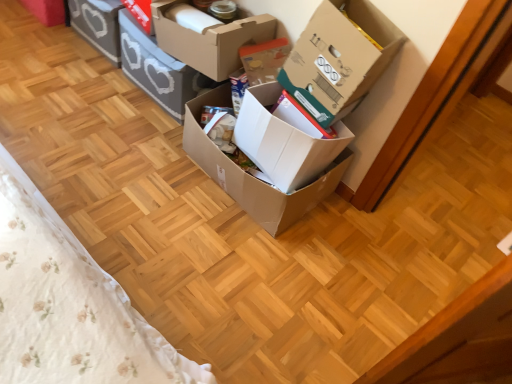
Question: Is cardboard box at center, arranged as the 5th box when viewed from the left, located outside matte gray storage box at upper left, the first box positioned from the left?

Choices:
 (A) yes
 (B) no

Answer: (A)

Question: From a real-world perspective, is cardboard box at center, placed as the second box when sorted from right to left, on top of matte gray storage box at upper left, the first box positioned from the left?

Choices:
 (A) yes
 (B) no

Answer: (A)

Question: Could matte gray storage box at upper left, which is the sixth box from right to left, be considered to be inside cardboard box at center, placed as the second box when sorted from right to left?

Choices:
 (A) no
 (B) yes

Answer: (A)

Question: Is cardboard box at center, placed as the second box when sorted from right to left, positioned in front of matte gray storage box at upper left, which is the sixth box from right to left?

Choices:
 (A) no
 (B) yes

Answer: (B)

Question: Can you confirm if cardboard box at center, placed as the second box when sorted from right to left, is wider than matte gray storage box at upper left, the first box positioned from the left?

Choices:
 (A) yes
 (B) no

Answer: (A)

Question: Considering the positions of cardboard box at center, which ranks as the third box in left-to-right order, and matte gray storage box at upper left, the first box positioned from the left, in the image, is cardboard box at center, which ranks as the third box in left-to-right order, bigger or smaller than matte gray storage box at upper left, the first box positioned from the left,?

Choices:
 (A) big
 (B) small

Answer: (A)

Question: Based on their positions, is cardboard box at center, which ranks as the third box in left-to-right order, located to the left or right of matte gray storage box at upper left, the first box positioned from the left?

Choices:
 (A) left
 (B) right

Answer: (B)

Question: From the image's perspective, is cardboard box at center, which is the fourth box from right to left, located above or below matte gray storage box at upper left, the first box positioned from the left?

Choices:
 (A) below
 (B) above

Answer: (A)

Question: Is cardboard box at center, which is the fourth box from right to left, in front of or behind matte gray storage box at upper left, which is the sixth box from right to left, in the image?

Choices:
 (A) behind
 (B) front

Answer: (B)

Question: Looking at their shapes, would you say brown cardboard box at center, marked as the 4th box in a left-to-right arrangement, is wider or thinner than cardboard box at center, which is the fourth box from right to left?

Choices:
 (A) thin
 (B) wide

Answer: (B)

Question: Considering the positions of point (296, 155) and point (186, 18), is point (296, 155) closer or farther from the camera than point (186, 18)?

Choices:
 (A) closer
 (B) farther

Answer: (A)

Question: Based on their sizes in the image, would you say brown cardboard box at center, marked as the 4th box in a left-to-right arrangement, is bigger or smaller than cardboard box at center, which is the fourth box from right to left?

Choices:
 (A) big
 (B) small

Answer: (A)

Question: Relative to cardboard box at center, which is the fourth box from right to left, is brown cardboard box at center, marked as the 4th box in a left-to-right arrangement, in front or behind?

Choices:
 (A) behind
 (B) front

Answer: (B)

Question: Considering their positions, is cardboard box at upper right, the 6th box viewed from the left, located in front of or behind cardboard box at center, the 5th box positioned from the right?

Choices:
 (A) behind
 (B) front

Answer: (B)

Question: Is cardboard box at upper right, which ranks as the 1th box in right-to-left order, inside or outside of cardboard box at center, the second box in the left-to-right sequence?

Choices:
 (A) inside
 (B) outside

Answer: (B)